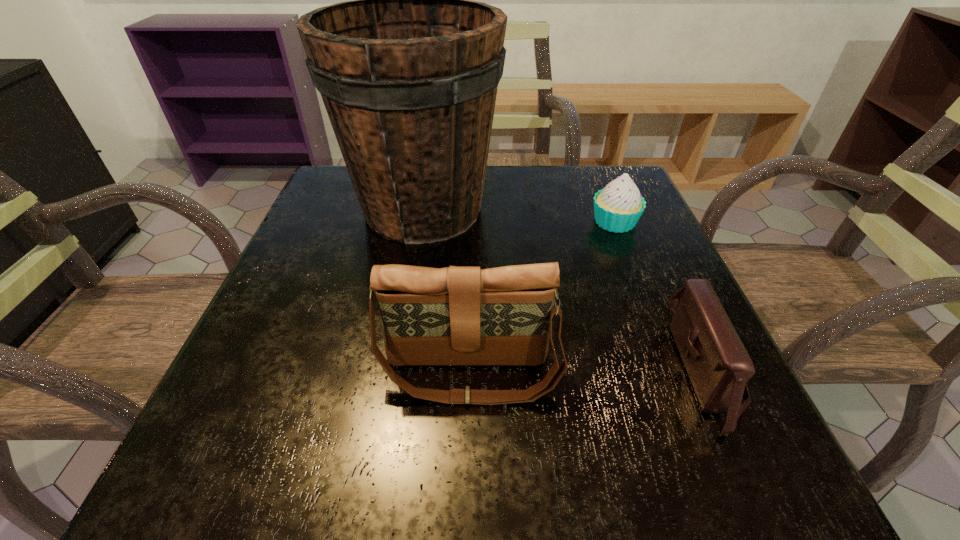
Where is `vacant space at the far edge of the desktop`? The height and width of the screenshot is (540, 960). vacant space at the far edge of the desktop is located at coordinates (554, 204).

The height and width of the screenshot is (540, 960). Identify the location of vacant space at the near edge of the desktop. (609, 442).

The image size is (960, 540). I want to click on vacant area at the left edge, so click(265, 315).

In the image, there is a desktop. At what (x,y) coordinates should I click in order to perform the action: click on vacant space at the right edge. Please return your answer as a coordinate pair (x, y). Image resolution: width=960 pixels, height=540 pixels. Looking at the image, I should click on (659, 350).

This screenshot has width=960, height=540. I want to click on vacant area at the far left corner, so click(344, 165).

Locate an element on the screen. The width and height of the screenshot is (960, 540). vacant space at the near left corner of the desktop is located at coordinates (161, 498).

Image resolution: width=960 pixels, height=540 pixels. Identify the location of vacant space at the far right corner of the desktop. (605, 174).

Where is `free space between the cupcake and the shorter shoulder bag`? This screenshot has height=540, width=960. free space between the cupcake and the shorter shoulder bag is located at coordinates (660, 295).

Where is `vacant space in between the shorter shoulder bag and the cupcake`? This screenshot has height=540, width=960. vacant space in between the shorter shoulder bag and the cupcake is located at coordinates (660, 295).

This screenshot has width=960, height=540. Identify the location of free point between the shorter shoulder bag and the bucket. (564, 289).